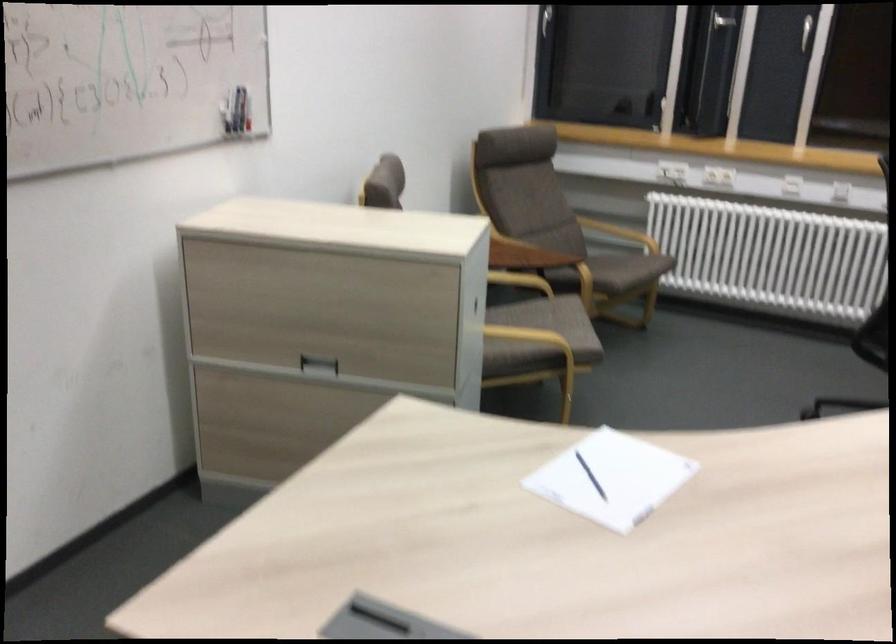
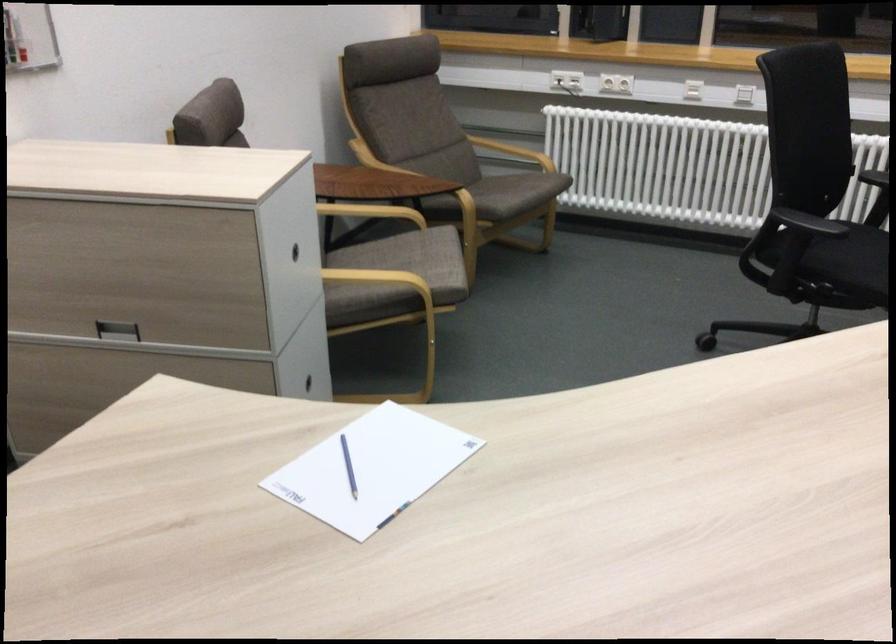
Locate, in the second image, the point that corresponds to (x=311, y=361) in the first image.

(116, 330)